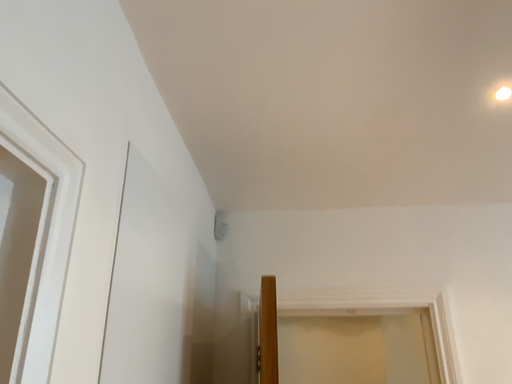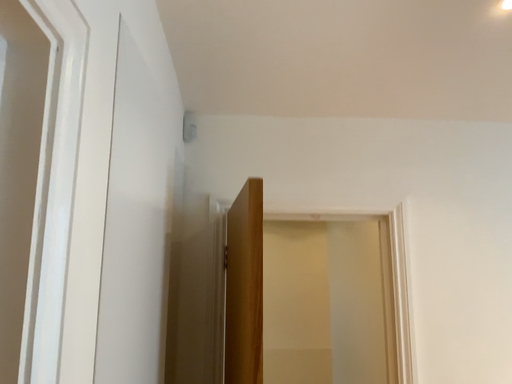
Question: Which way did the camera rotate in the video?

Choices:
 (A) rotated upward
 (B) rotated downward

Answer: (B)